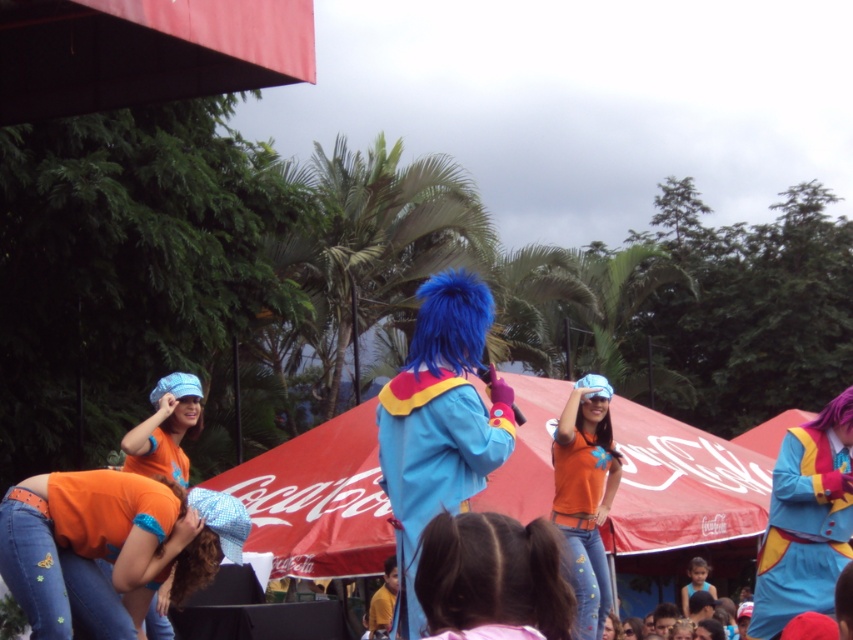
You are standing in the crowd at the event and want to take a photo of the matte blue costume at center. If your camera has a maximum focus range of 10 meters, will you be able to capture a clear photo?

The matte blue costume at center is 11.81 meters away from the viewer, which exceeds the camera maximum focus range of 10 meters. Therefore, you won not be able to capture a clear photo.

You are an event organizer checking the stage setup. You need to ensure that the matte blue costume at center and the matte blue fabric hat at lower left are visible to the audience. Given that the audience is seated in front of the stage, which object will appear wider to them?

The matte blue costume at center will appear wider to the audience because its width surpasses that of the matte blue fabric hat at lower left.